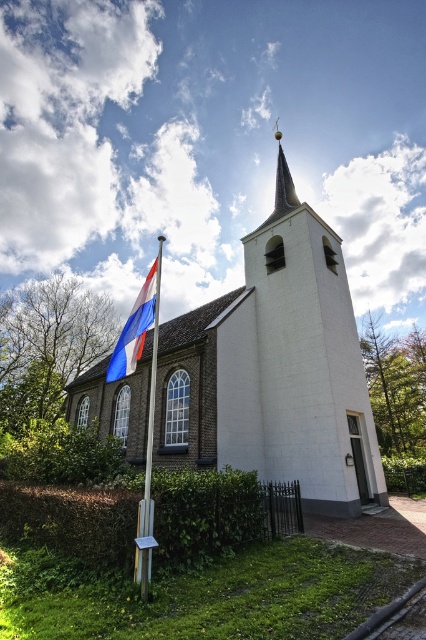
Question: Is white brick church at center below polished metal flag pole at center-left?

Choices:
 (A) no
 (B) yes

Answer: (B)

Question: Among these points, which one is farthest from the camera?

Choices:
 (A) (207, 371)
 (B) (150, 456)
 (C) (132, 337)

Answer: (B)

Question: Is green leafy hedge at lower left in front of blue-white striped flag at left?

Choices:
 (A) no
 (B) yes

Answer: (B)

Question: Does blue-white striped flag at left appear on the left side of polished metal flag pole at center-left?

Choices:
 (A) yes
 (B) no

Answer: (A)

Question: Which object appears farthest from the camera in this image?

Choices:
 (A) blue-white striped flag at left
 (B) polished metal flag pole at center-left
 (C) green leafy hedge at lower left

Answer: (A)

Question: Among these points, which one is farthest from the camera?

Choices:
 (A) (310, 292)
 (B) (143, 326)
 (C) (152, 365)

Answer: (C)